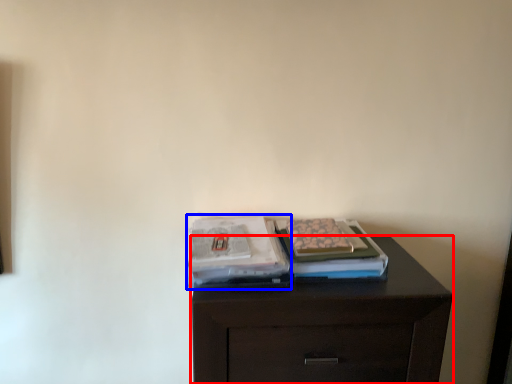
Question: Which point is closer to the camera, chest of drawers (highlighted by a red box) or magazine (highlighted by a blue box)?

Choices:
 (A) chest of drawers
 (B) magazine

Answer: (A)